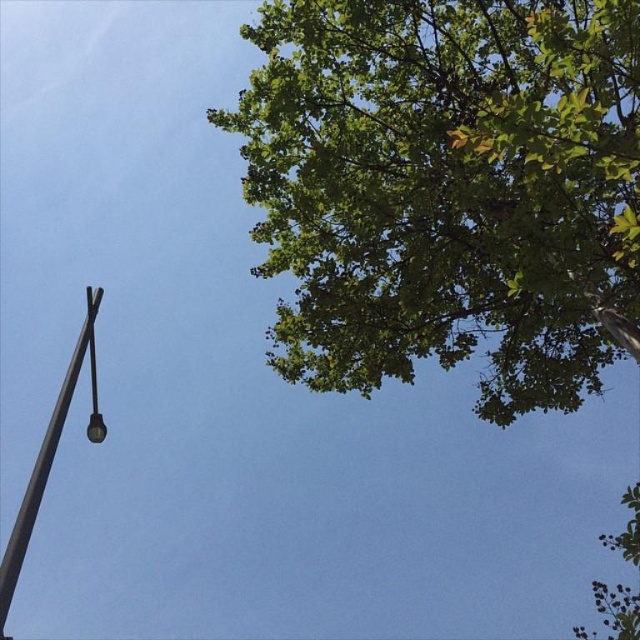
Is green leafy tree at upper right positioned in front of polished metal pole at left?

That is True.

Who is more distant from viewer, [371,381] or [58,413]?

The point [371,381] is behind.

Identify the location of green leafy tree at upper right. The image size is (640, 640). (448, 189).